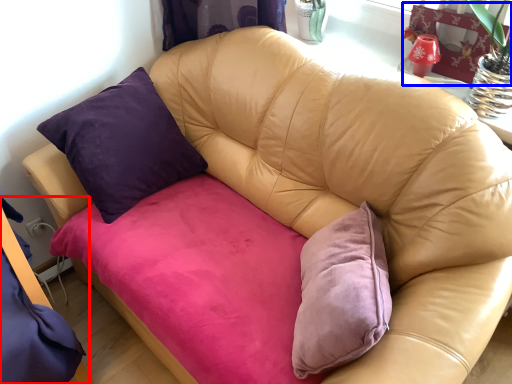
Question: Which of the following is the closest to the observer, bed frame (highlighted by a red box) or swivel chair (highlighted by a blue box)?

Choices:
 (A) bed frame
 (B) swivel chair

Answer: (A)